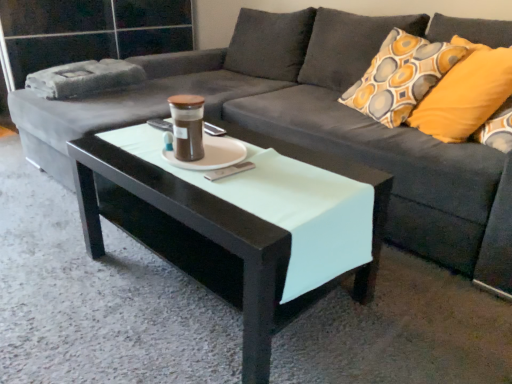
The height and width of the screenshot is (384, 512). What do you see at coordinates (209, 153) in the screenshot?
I see `white matte saucer at center` at bounding box center [209, 153].

This screenshot has height=384, width=512. What are the coordinates of `transparent glass door at upper left` in the screenshot? It's located at (90, 31).

From a real-world perspective, between white matte saucer at center and brown glass jar at center, who is vertically higher?

brown glass jar at center, from a real-world perspective.

Can you tell me how much white matte saucer at center and brown glass jar at center differ in facing direction?

The angle between the facing direction of white matte saucer at center and the facing direction of brown glass jar at center is 0.000669 degrees.

Consider the image. Can you confirm if white matte saucer at center is wider than brown glass jar at center?

Indeed, white matte saucer at center has a greater width compared to brown glass jar at center.

Consider the image. Between white matte saucer at center and brown glass jar at center, which one appears on the right side from the viewer's perspective?

white matte saucer at center.

Which object is more forward, black glossy coffee table at center or transparent glass door at upper left?

Positioned in front is black glossy coffee table at center.

Does black glossy coffee table at center appear on the right side of transparent glass door at upper left?

Yes.

Does point (245, 337) come closer to viewer compared to point (88, 28)?

Yes.

Is point (238, 144) farther from viewer compared to point (477, 49)?

No.

I want to click on saucer lying below the yellow fabric pillow at right (from the image's perspective), so click(209, 153).

How distant is white matte saucer at center from yellow fabric pillow at right?

93.36 centimeters.

Is white matte saucer at center outside of yellow fabric pillow at right?

white matte saucer at center lies outside yellow fabric pillow at right's area.

Considering the sizes of objects white matte saucer at center and transparent glass door at upper left in the image provided, who is taller, white matte saucer at center or transparent glass door at upper left?

With more height is transparent glass door at upper left.

Which is in front, point (233, 158) or point (48, 28)?

Positioned in front is point (233, 158).

Would you consider white matte saucer at center to be distant from transparent glass door at upper left?

Yes, white matte saucer at center and transparent glass door at upper left are quite far apart.

In terms of width, does yellow fabric pillow at right look wider or thinner when compared to black glossy coffee table at center?

In the image, yellow fabric pillow at right appears to be more narrow than black glossy coffee table at center.

Does yellow fabric pillow at right have a larger size compared to black glossy coffee table at center?

No.

From the image's perspective, is yellow fabric pillow at right beneath black glossy coffee table at center?

Actually, yellow fabric pillow at right appears above black glossy coffee table at center in the image.

Does point (278, 265) come closer to viewer compared to point (170, 162)?

Yes, it is in front of point (170, 162).

How far apart are black glossy coffee table at center and white matte saucer at center?

A distance of 12.35 inches exists between black glossy coffee table at center and white matte saucer at center.

Which of these two, black glossy coffee table at center or white matte saucer at center, is bigger?

black glossy coffee table at center is bigger.

From the image's perspective, is black glossy coffee table at center on white matte saucer at center?

Actually, black glossy coffee table at center appears below white matte saucer at center in the image.

Considering the points (470, 66) and (189, 128), which point is behind, point (470, 66) or point (189, 128)?

The point (470, 66) is behind.

From the image's perspective, would you say yellow fabric pillow at right is shown under brown glass jar at center?

No, from the image's perspective, yellow fabric pillow at right is not beneath brown glass jar at center.

What's the angular difference between yellow fabric pillow at right and brown glass jar at center's facing directions?

They differ by 21.9 degrees in their facing directions.

The width and height of the screenshot is (512, 384). I want to click on saucer behind the brown glass jar at center, so click(209, 153).

Identify the location of coffee table on the right of transparent glass door at upper left. (217, 233).

From the image, which object appears to be farther from transparent glass door at upper left, white matte saucer at center or brown glass jar at center?

brown glass jar at center.

Estimate the real-world distances between objects in this image. Which object is further from transparent glass door at upper left, white matte saucer at center or black glossy coffee table at center?

Based on the image, white matte saucer at center appears to be further to transparent glass door at upper left.

When comparing their distances from white matte saucer at center, does yellow fabric pillow at right or black glossy coffee table at center seem further?

The object further to white matte saucer at center is yellow fabric pillow at right.

Considering their positions, is white matte saucer at center positioned closer to brown glass jar at center than transparent glass door at upper left?

The object closer to brown glass jar at center is white matte saucer at center.

Based on their spatial positions, is transparent glass door at upper left or black glossy coffee table at center closer to yellow fabric pillow at right?

black glossy coffee table at center lies closer to yellow fabric pillow at right than the other object.

Considering their positions, is transparent glass door at upper left positioned further to yellow fabric pillow at right than brown glass jar at center?

Among the two, transparent glass door at upper left is located further to yellow fabric pillow at right.

When comparing their distances from yellow fabric pillow at right, does white matte saucer at center or transparent glass door at upper left seem further?

Based on the image, transparent glass door at upper left appears to be further to yellow fabric pillow at right.

When comparing their distances from brown glass jar at center, does transparent glass door at upper left or yellow fabric pillow at right seem closer?

yellow fabric pillow at right is positioned closer to the anchor brown glass jar at center.

Identify the location of saucer between transparent glass door at upper left and yellow fabric pillow at right. (209, 153).

In order to click on saucer between brown glass jar at center and yellow fabric pillow at right in this screenshot , I will do [209, 153].

Identify the location of coffee table between white matte saucer at center and yellow fabric pillow at right from left to right. The width and height of the screenshot is (512, 384). (217, 233).

You are a GUI agent. You are given a task and a screenshot of the screen. Output one action in this format:
    pyautogui.click(x=<x>, y=<y>)
    Task: Click on the beverage positioned between black glossy coffee table at center and white matte saucer at center from near to far
    This screenshot has height=384, width=512.
    Given the screenshot: What is the action you would take?
    pyautogui.click(x=187, y=126)